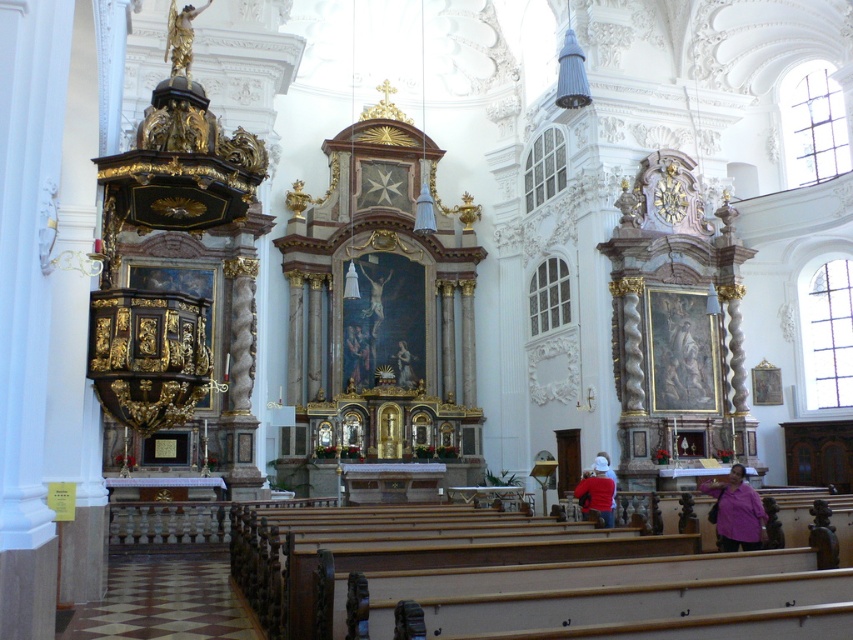
Question: Which point is farther from the camera taking this photo?

Choices:
 (A) (758, 540)
 (B) (685, 202)
 (C) (405, 358)
 (D) (590, 483)

Answer: (C)

Question: Based on their relative distances, which object is farther from the gold textured clock at upper right?

Choices:
 (A) gold ornate statue at center
 (B) purple fabric at lower right

Answer: (B)

Question: Which point is closer to the camera?

Choices:
 (A) gold ornate statue at center
 (B) gold textured clock at upper right
 (C) purple fabric at lower right
 (D) red matte jacket at center

Answer: (C)

Question: Can you confirm if purple fabric at lower right is positioned to the left of gold ornate statue at center?

Choices:
 (A) no
 (B) yes

Answer: (A)

Question: Can you confirm if red matte jacket at center is positioned to the left of gold textured clock at upper right?

Choices:
 (A) yes
 (B) no

Answer: (A)

Question: Is gold textured clock at upper right positioned behind gold ornate statue at center?

Choices:
 (A) no
 (B) yes

Answer: (A)